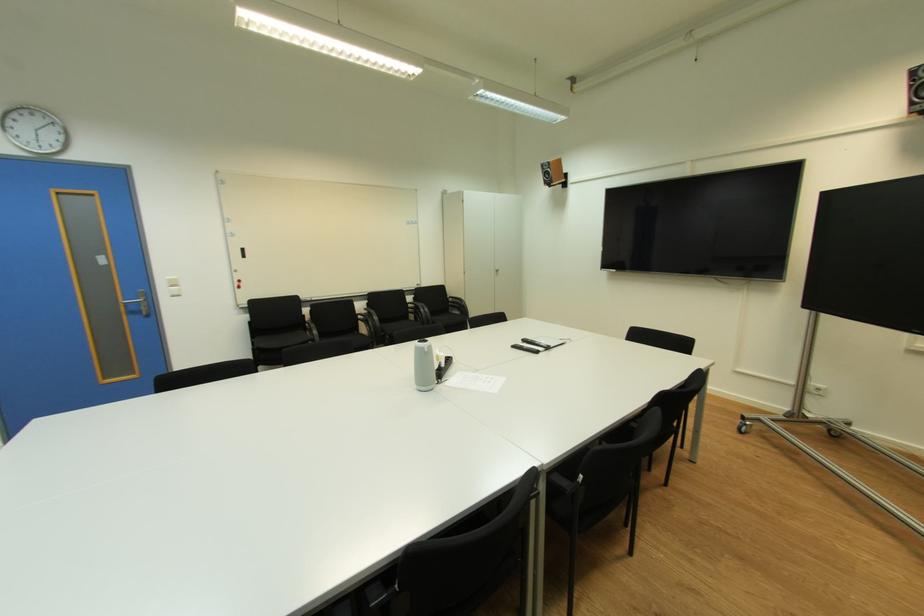
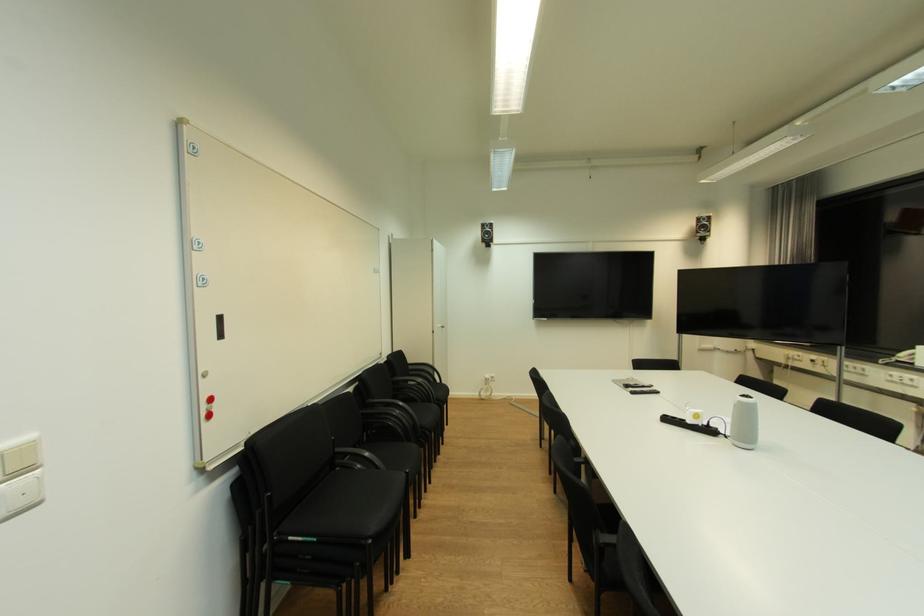
Locate, in the second image, the point that corresponds to point (180, 294) in the first image.

(26, 505)